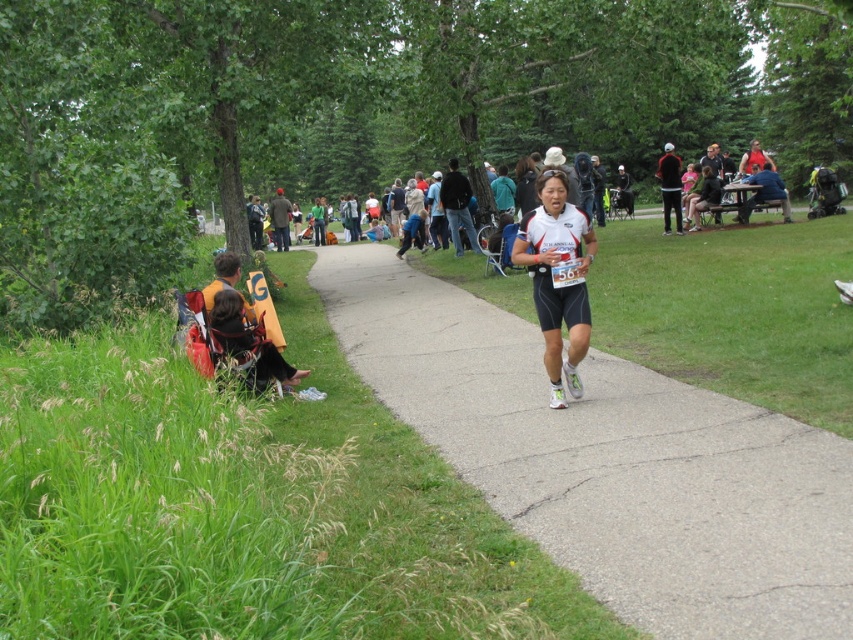
You are a runner in the race and you want to reach the finish line. You are currently at point (555,529). The finish line is at point (573,368). Is the finish line behind you or in front of you?

Point (555,529) is in front of point (573,368). Therefore, the finish line at point (573,368) is behind you.

In the scene shown: You are a runner participating in the event and want to get your jacket from the black matte jacket at upper right. Which direction should you move from the gray asphalt pavement at center to reach it?

The gray asphalt pavement at center is to the left of the black matte jacket at upper right, so you should move to the right to reach it.

You are a photographer standing at the starting line of the race. You want to take a photo that includes both the point at coordinates point [552,371] and point [660,170]. Which point should you focus on first to ensure both are in sharp focus?

You should focus on point [552,371] first because it is closer to the camera than point [660,170]. This ensures the closer point is in focus, and the farther point will also be in focus due to depth of field.